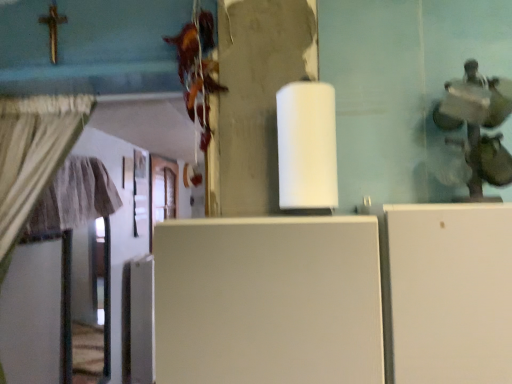
Question: Is point (x=184, y=352) positioned closer to the camera than point (x=151, y=153)?

Choices:
 (A) farther
 (B) closer

Answer: (B)

Question: From the image's perspective, is white matte refrigerator at center located above or below wooden at left?

Choices:
 (A) below
 (B) above

Answer: (A)

Question: Is white matte refrigerator at center inside or outside of wooden at left?

Choices:
 (A) outside
 (B) inside

Answer: (A)

Question: In terms of width, does wooden at left look wider or thinner when compared to white matte refrigerator at center?

Choices:
 (A) thin
 (B) wide

Answer: (A)

Question: Considering the relative positions of wooden at left and white matte refrigerator at center in the image provided, is wooden at left to the left or to the right of white matte refrigerator at center?

Choices:
 (A) left
 (B) right

Answer: (A)

Question: In terms of size, does wooden at left appear bigger or smaller than white matte refrigerator at center?

Choices:
 (A) big
 (B) small

Answer: (B)

Question: From the image's perspective, is wooden at left positioned above or below white matte refrigerator at center?

Choices:
 (A) above
 (B) below

Answer: (A)